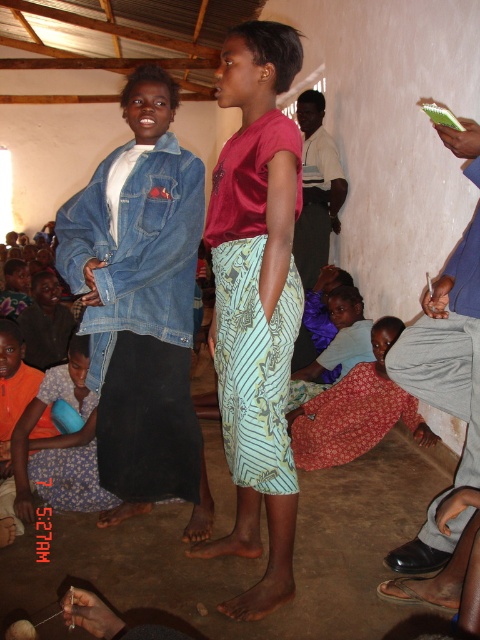
Based on the photo, you are a photographer setting up a shoot in this indoor space. You need to position a tall tripod that requires 1.8 meters of vertical clearance. Looking at the denim jacket at left and the printed fabric dress at lower center, which object would you use to estimate the minimum height requirement for the tripod?

The denim jacket at left is much taller than the printed fabric dress at lower center. Since the tripod needs 1.8 meters of vertical clearance, you should use the height of the denim jacket at left as a reference to ensure there is enough space.